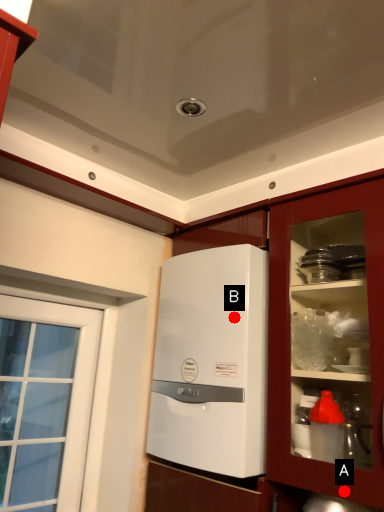
Question: Two points are circled on the image, labeled by A and B beside each circle. Among these points, which one is nearest to the camera?

Choices:
 (A) A is closer
 (B) B is closer

Answer: (A)